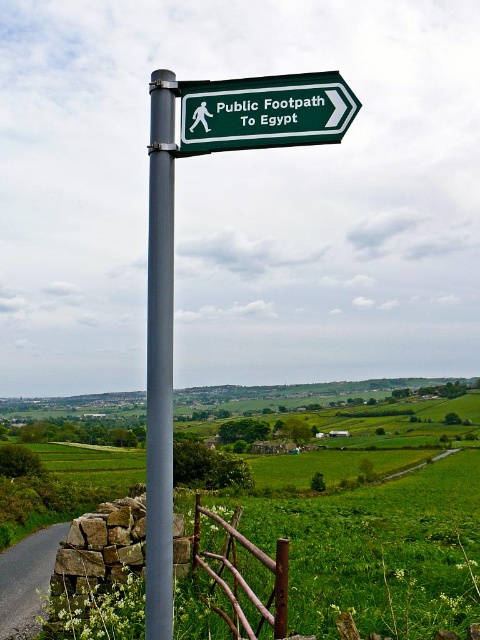
Question: Is gray metallic pole at center closer to camera compared to rustic wood fence at lower center?

Choices:
 (A) yes
 (B) no

Answer: (A)

Question: Which of these objects is positioned closest to the rustic wood fence at lower center?

Choices:
 (A) green matte signpost at upper center
 (B) gray metallic pole at center

Answer: (B)

Question: From the image, what is the correct spatial relationship of gray metallic pole at center in relation to rustic wood fence at lower center?

Choices:
 (A) right
 (B) left

Answer: (B)

Question: Which is nearer to the green matte signpost at upper center?

Choices:
 (A) gray metallic pole at center
 (B) rustic wood fence at lower center

Answer: (A)

Question: Where is gray metallic pole at center located in relation to green matte signpost at upper center in the image?

Choices:
 (A) right
 (B) left

Answer: (B)

Question: Which point appears closest to the camera in this image?

Choices:
 (A) (162, 499)
 (B) (287, 576)

Answer: (A)